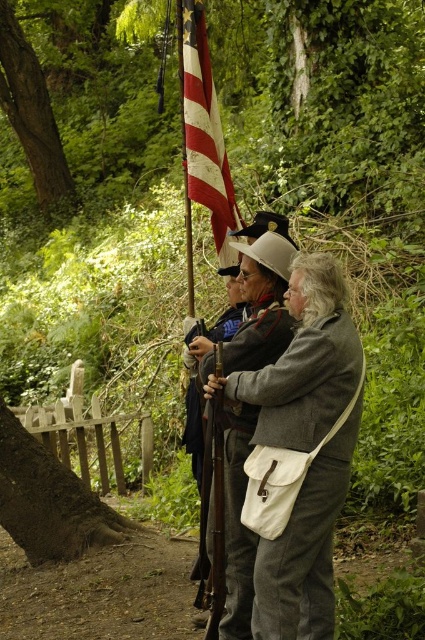
Can you confirm if gray wool coat at center is bigger than wooden rifle at center?

Indeed, gray wool coat at center has a larger size compared to wooden rifle at center.

Is the position of gray wool coat at center less distant than that of wooden rifle at center?

No, it is not.

Is point (255, 301) closer to camera compared to point (220, 593)?

No, (255, 301) is behind (220, 593).

Locate an element on the screen. The image size is (425, 640). gray wool coat at center is located at coordinates 238,406.

Is point (223, 250) behind point (221, 573)?

Yes, point (223, 250) is behind point (221, 573).

Does american flag at center have a lesser width compared to wooden rifle at center?

In fact, american flag at center might be wider than wooden rifle at center.

Is point (212, 84) positioned behind point (223, 582)?

Yes, point (212, 84) is behind point (223, 582).

You are a GUI agent. You are given a task and a screenshot of the screen. Output one action in this format:
    pyautogui.click(x=<x>, y=<y>)
    Task: Click on the american flag at center
    The image size is (425, 640).
    Given the screenshot: What is the action you would take?
    pyautogui.click(x=204, y=131)

Is american flag at center bigger than shiny brown leather sword at center?

Indeed, american flag at center has a larger size compared to shiny brown leather sword at center.

Does point (193, 100) come closer to viewer compared to point (193, 458)?

No, (193, 100) is further to viewer.

The height and width of the screenshot is (640, 425). What are the coordinates of `american flag at center` in the screenshot? It's located at (204, 131).